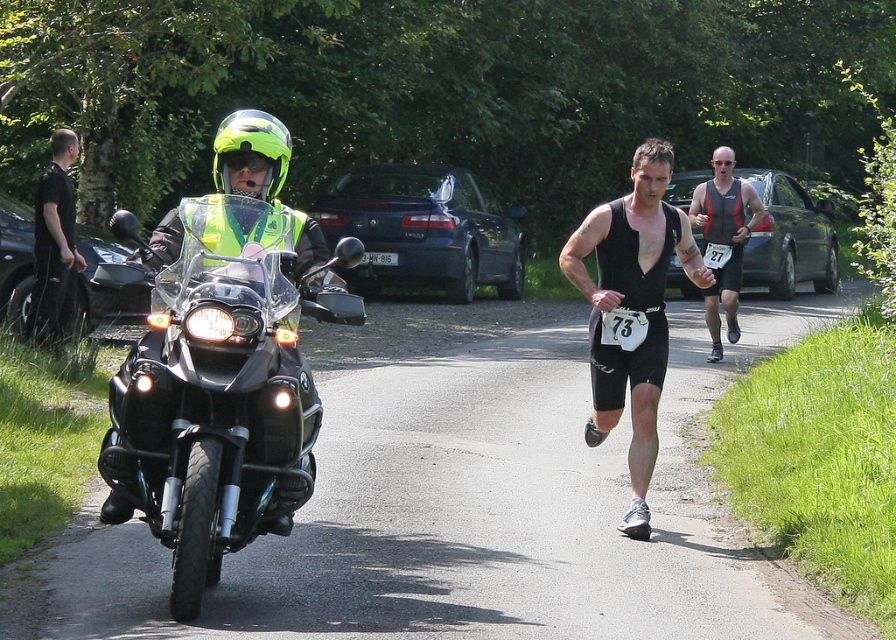
Measure the distance between point (642,296) and camera.

The distance of point (642,296) from camera is 7.79 meters.

Does black matte triathlon suit at center appear under black fabric shirt at left?

Yes, black matte triathlon suit at center is below black fabric shirt at left.

You are a GUI agent. You are given a task and a screenshot of the screen. Output one action in this format:
    pyautogui.click(x=<x>, y=<y>)
    Task: Click on the black matte triathlon suit at center
    Image resolution: width=896 pixels, height=640 pixels.
    Given the screenshot: What is the action you would take?
    pyautogui.click(x=631, y=310)

Is black mesh tank top at center smaller than green matte helmet at center?

No, black mesh tank top at center is not smaller than green matte helmet at center.

Who is more forward, (728, 269) or (224, 161)?

Point (224, 161) is more forward.

Who is more distant from viewer, (733, 266) or (246, 150)?

The point (733, 266) is behind.

This screenshot has width=896, height=640. I want to click on black mesh tank top at center, so click(724, 240).

Is black matte motorcycle at left bigger than reflective yellow safety vest at center?

Correct, black matte motorcycle at left is larger in size than reflective yellow safety vest at center.

Does black matte motorcycle at left have a smaller size compared to reflective yellow safety vest at center?

Incorrect, black matte motorcycle at left is not smaller in size than reflective yellow safety vest at center.

Is point (248, 531) more distant than point (721, 204)?

That is False.

Identify the location of black matte motorcycle at left. (221, 388).